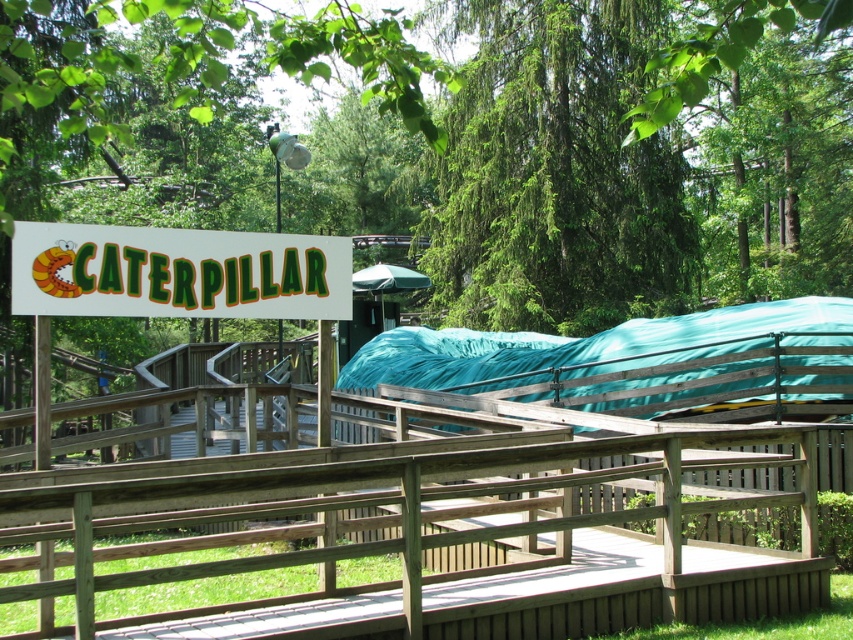
Question: Is wooden rail at center to the left of white plastic sign at upper left from the viewer's perspective?

Choices:
 (A) yes
 (B) no

Answer: (B)

Question: Which point appears farthest from the camera in this image?

Choices:
 (A) (370, 268)
 (B) (231, 316)
 (C) (637, 257)
 (D) (82, 616)

Answer: (C)

Question: Is wooden rail at center wider than white plastic sign at upper left?

Choices:
 (A) yes
 (B) no

Answer: (A)

Question: Is green leafy tree at upper center behind white plastic sign at upper left?

Choices:
 (A) no
 (B) yes

Answer: (B)

Question: Which is nearer to the white plastic sign at upper left?

Choices:
 (A) green fabric canopy at center
 (B) wooden rail at center

Answer: (B)

Question: Which point appears farthest from the camera in this image?

Choices:
 (A) (573, 193)
 (B) (463, 618)

Answer: (A)